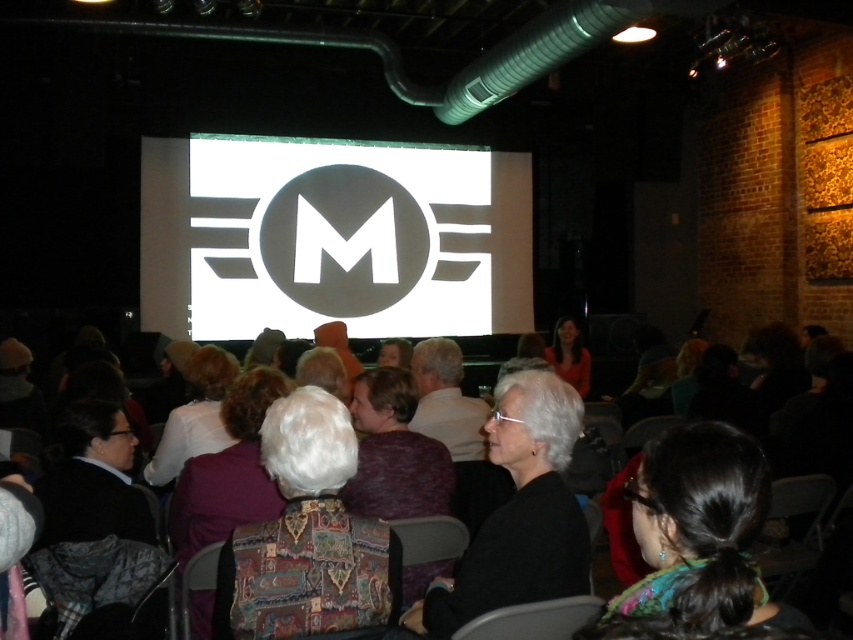
You are a photographer at the event and need to capture a clear shot of the screen. There are two obstacles in the way of your camera lens. The white fabric at center and the matte black jacket at center. Which obstacle is closer to the camera lens?

The white fabric at center is below matte black jacket at center, meaning it is closer to the camera lens. Therefore, you should adjust your position to avoid the white fabric at center first.

You are at the indoor event and want to move from the point at coordinates point (189, 522) to the point at coordinates point (555, 364). Which direction should you move to get closer to your destination?

To move from point (189, 522) to point (555, 364), you should move backward since point (189, 522) is in front of point (555, 364).

You are standing at the entrance of the room and want to locate the patterned fabric jacket at center. Based on the coordinates provided, in which direction should you look to find it?

The patterned fabric jacket at center is located at coordinates point (228, 470), so you should look towards the lower right direction from the entrance to find it.